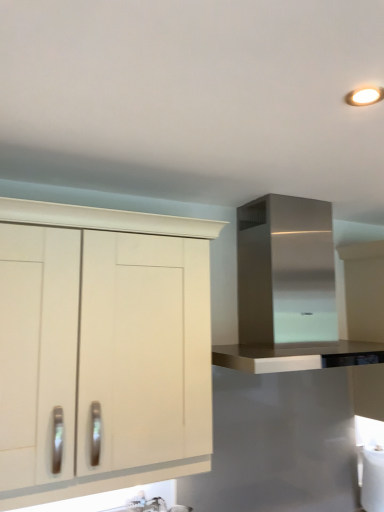
Question: From the image's perspective, is stainless steel range hood at upper right, placed as the 2th cabinetry when sorted from left to right, located above or below white matte cabinet at left, which is the 2th cabinetry in right-to-left order?

Choices:
 (A) below
 (B) above

Answer: (B)

Question: From a real-world perspective, relative to white matte cabinet at left, which is counted as the 1th cabinetry, starting from the left, is stainless steel range hood at upper right, placed as the 2th cabinetry when sorted from left to right, vertically above or below?

Choices:
 (A) above
 (B) below

Answer: (A)

Question: Relative to white matte cabinet at left, which is counted as the 1th cabinetry, starting from the left, is stainless steel range hood at upper right, placed as the 2th cabinetry when sorted from left to right, in front or behind?

Choices:
 (A) front
 (B) behind

Answer: (B)

Question: From the image's perspective, is white matte cabinet at left, which is the 2th cabinetry in right-to-left order, located above or below stainless steel range hood at upper right, the first cabinetry in the right-to-left sequence?

Choices:
 (A) above
 (B) below

Answer: (B)

Question: Considering their positions, is white matte cabinet at left, which is the 2th cabinetry in right-to-left order, located in front of or behind stainless steel range hood at upper right, the first cabinetry in the right-to-left sequence?

Choices:
 (A) behind
 (B) front

Answer: (B)

Question: Is point [x=114, y=364] closer or farther from the camera than point [x=261, y=362]?

Choices:
 (A) closer
 (B) farther

Answer: (A)

Question: From a real-world perspective, relative to stainless steel range hood at upper right, placed as the 2th cabinetry when sorted from left to right, is white matte cabinet at left, which is the 2th cabinetry in right-to-left order, vertically above or below?

Choices:
 (A) below
 (B) above

Answer: (A)